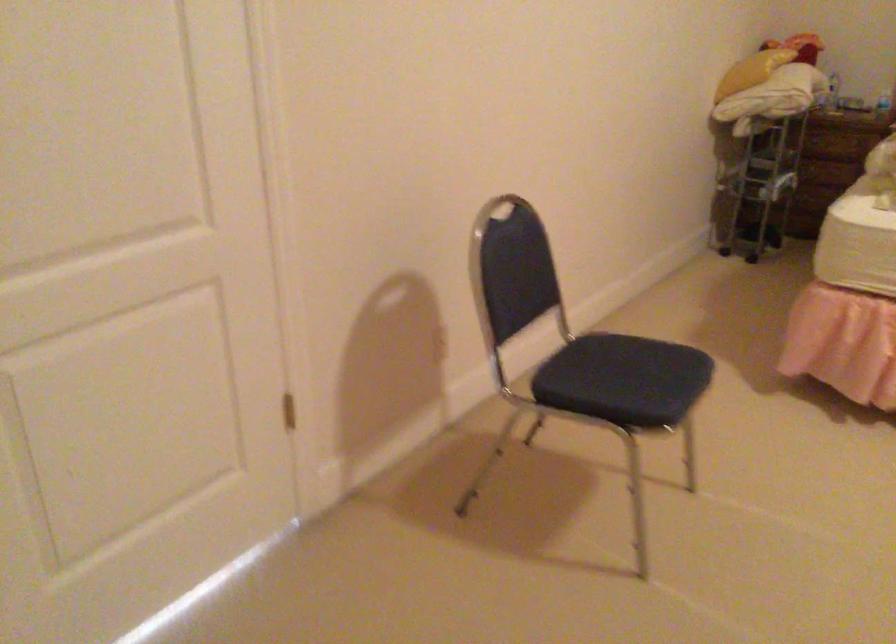
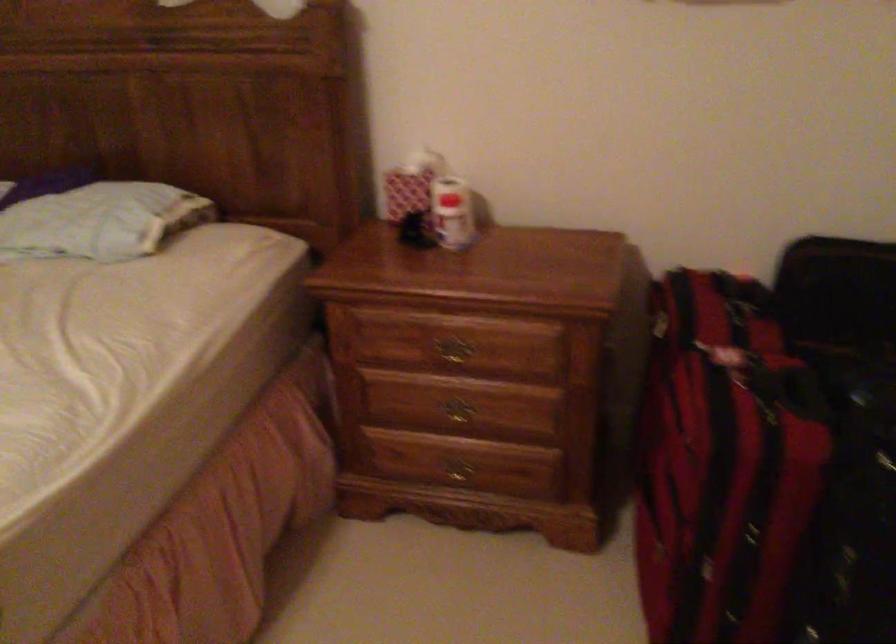
Question: Which direction would the cameraman need to move to produce the second image? Reply with the corresponding letter.

Choices:
 (A) Left
 (B) Right
 (C) Forward
 (D) Backward

Answer: (B)